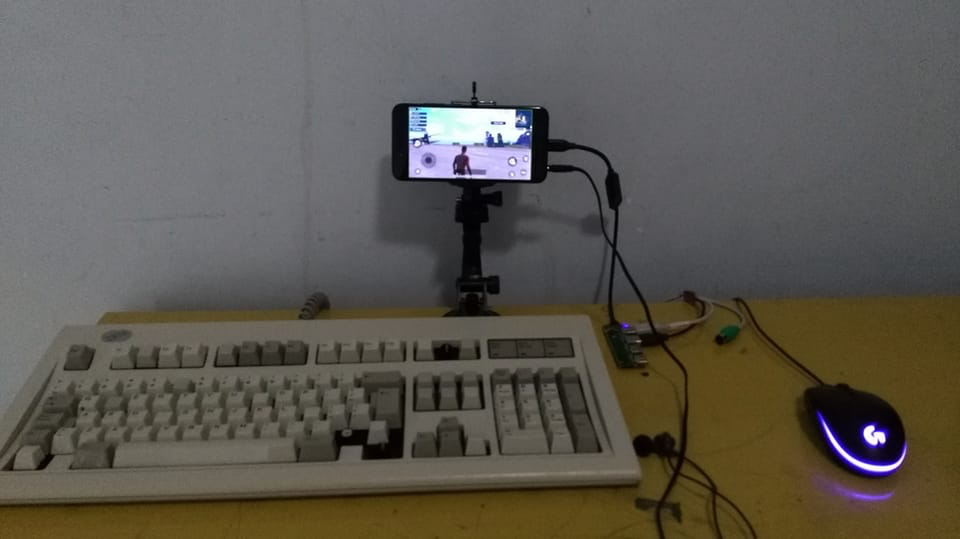
The height and width of the screenshot is (539, 960). Identify the location of keyboard wire. (315, 297).